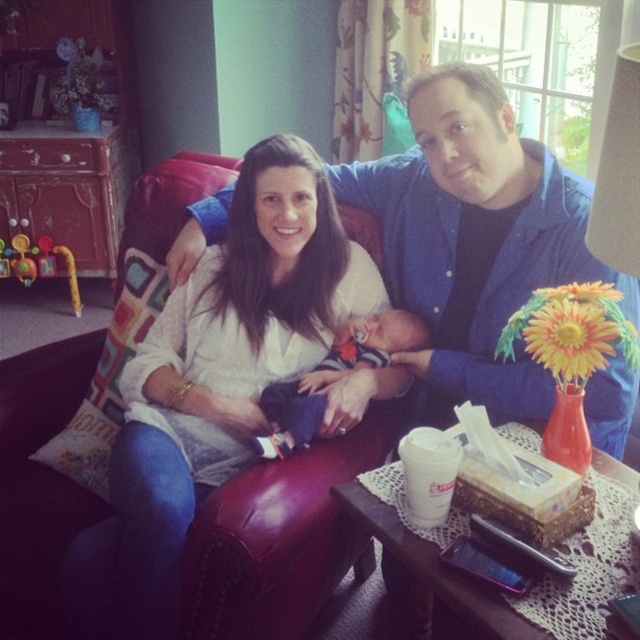
Question: Is white soft fabric at center below soft blue fabric newborn at center?

Choices:
 (A) yes
 (B) no

Answer: (A)

Question: Which point is closer to the camera?

Choices:
 (A) (241, 205)
 (B) (272, 422)

Answer: (B)

Question: Is white soft fabric at center smaller than soft blue fabric newborn at center?

Choices:
 (A) no
 (B) yes

Answer: (A)

Question: Which of the following is the closest to the observer?

Choices:
 (A) (100, 532)
 (B) (349, 337)

Answer: (A)

Question: Does white soft fabric at center have a greater width compared to soft blue fabric newborn at center?

Choices:
 (A) no
 (B) yes

Answer: (B)